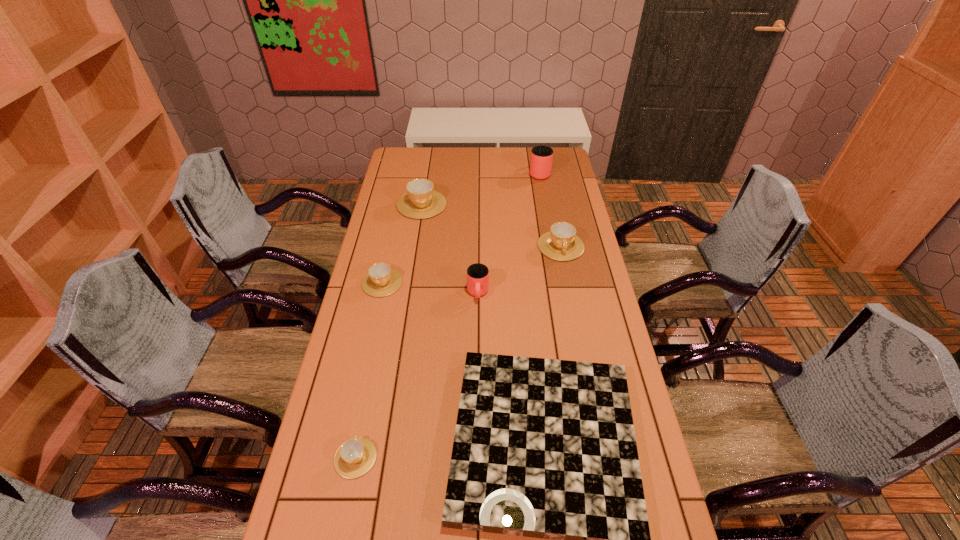
You are a GUI agent. You are given a task and a screenshot of the screen. Output one action in this format:
    pyautogui.click(x=<x>, y=<y>)
    Task: Click on the farther pink cup
    This screenshot has width=960, height=540.
    Given the screenshot: What is the action you would take?
    pyautogui.click(x=541, y=159)

This screenshot has width=960, height=540. I want to click on the tallest object, so click(541, 159).

Identify the location of the second farthest object. (421, 201).

Find the location of `the farthest brown cup`. the farthest brown cup is located at coordinates (421, 201).

I want to click on the nearer pink cup, so pos(477,274).

The height and width of the screenshot is (540, 960). Find the location of `the smaller pink cup`. the smaller pink cup is located at coordinates (477, 274).

This screenshot has width=960, height=540. I want to click on the fourth tallest cup, so click(x=561, y=243).

Identify the location of the third smallest brown cup. (561, 243).

Image resolution: width=960 pixels, height=540 pixels. In order to click on the fifth tallest object in this screenshot , I will do `click(381, 280)`.

Identify the location of the third biggest brown cup. (381, 280).